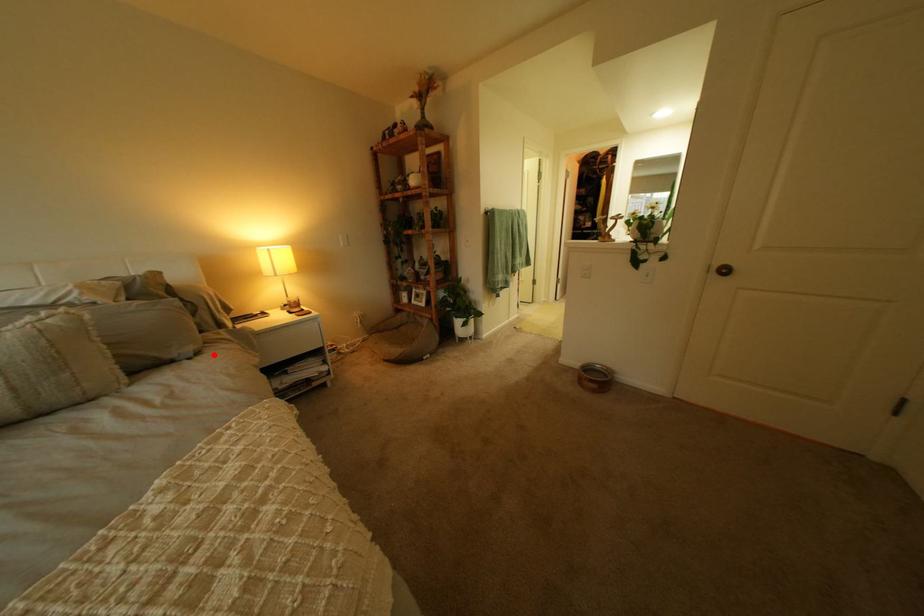
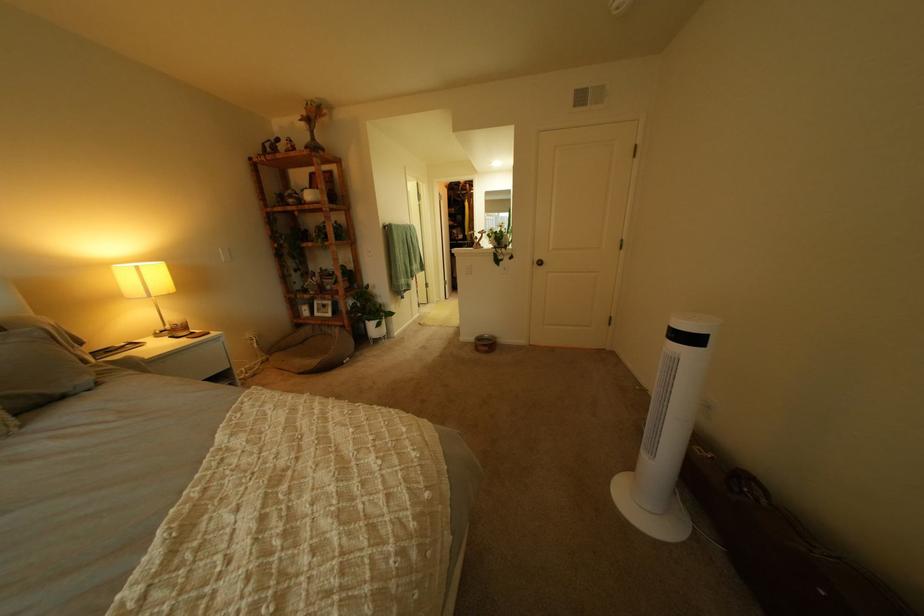
Locate, in the second image, the point that corresponds to the highlighted location in the first image.

(115, 385)